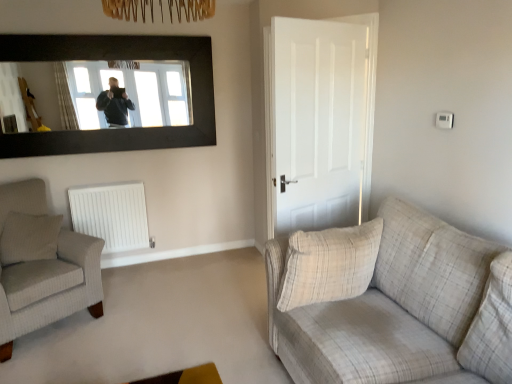
In order to face plaid fabric couch at right, should I rotate leftwards or rightwards?

Turn right by 20.790 degrees to look at plaid fabric couch at right.

Describe the element at coordinates (329, 264) in the screenshot. The width and height of the screenshot is (512, 384). I see `beige plaid pillow at right, positioned as the 2th pillow in left-to-right order` at that location.

What is the approximate width of beige plaid pillow at right, the first pillow viewed from the front?

beige plaid pillow at right, the first pillow viewed from the front, is 10.74 inches wide.

This screenshot has height=384, width=512. I want to click on white matte radiator at lower left, so click(x=112, y=215).

Can you tell me how much light gray fabric armchair at left and white matte door at center differ in facing direction?

light gray fabric armchair at left and white matte door at center are facing 167 degrees away from each other.

In terms of width, does light gray fabric armchair at left look wider or thinner when compared to white matte door at center?

Considering their sizes, light gray fabric armchair at left looks broader than white matte door at center.

Find the location of a particular element. Image resolution: width=512 pixels, height=384 pixels. door that appears behind the light gray fabric armchair at left is located at coordinates (319, 120).

Are light gray fabric armchair at left and white matte door at center located far from each other?

Absolutely, light gray fabric armchair at left is distant from white matte door at center.

Is point (111, 195) behind point (32, 254)?

Yes, point (111, 195) is farther from viewer.

From the image's perspective, is white matte radiator at lower left positioned above or below beige textured pillow at left, which is the 2th pillow in front-to-back order?

white matte radiator at lower left is situated higher than beige textured pillow at left, which is the 2th pillow in front-to-back order, in the image.

From a real-world perspective, between white matte radiator at lower left and beige textured pillow at left, acting as the 2th pillow starting from the right, who is vertically lower?

From a 3D spatial view, white matte radiator at lower left is below.

Is white matte radiator at lower left to the left or to the right of beige textured pillow at left, acting as the 2th pillow starting from the right, in the image?

Based on their positions, white matte radiator at lower left is located to the right of beige textured pillow at left, acting as the 2th pillow starting from the right.

Consider the image. Is the surface of white matte radiator at lower left in direct contact with white matte door at center?

No, white matte radiator at lower left is not touching white matte door at center.

Is point (129, 234) positioned in front of point (304, 87)?

No, it is behind (304, 87).

Image resolution: width=512 pixels, height=384 pixels. In order to click on radiator that appears below the white matte door at center (from the image's perspective) in this screenshot , I will do `click(112, 215)`.

From a real-world perspective, which is physically below, beige plaid pillow at right, arranged as the 1th pillow when viewed from the right, or plaid fabric couch at right?

plaid fabric couch at right, from a real-world perspective.

From the image's perspective, would you say beige plaid pillow at right, arranged as the 1th pillow when viewed from the right, is shown under plaid fabric couch at right?

→ Actually, beige plaid pillow at right, arranged as the 1th pillow when viewed from the right, appears above plaid fabric couch at right in the image.

Do you think beige plaid pillow at right, positioned as the 2th pillow in left-to-right order, is within plaid fabric couch at right, or outside of it?

beige plaid pillow at right, positioned as the 2th pillow in left-to-right order, can be found inside plaid fabric couch at right.

Image resolution: width=512 pixels, height=384 pixels. What are the coordinates of `chair above the white matte radiator at lower left (from a real-world perspective)` in the screenshot? It's located at (42, 265).

Considering the relative positions of light gray fabric armchair at left and white matte radiator at lower left in the image provided, is light gray fabric armchair at left to the left or to the right of white matte radiator at lower left?

Based on their positions, light gray fabric armchair at left is located to the left of white matte radiator at lower left.

Considering the sizes of light gray fabric armchair at left and white matte radiator at lower left in the image, is light gray fabric armchair at left taller or shorter than white matte radiator at lower left?

Clearly, light gray fabric armchair at left is taller compared to white matte radiator at lower left.

Identify the location of chair below the beige textured pillow at left, acting as the 2th pillow starting from the right (from a real-world perspective). The width and height of the screenshot is (512, 384). (42, 265).

Which of these two, light gray fabric armchair at left or beige textured pillow at left, acting as the 2th pillow starting from the right, stands taller?

Standing taller between the two is light gray fabric armchair at left.

Is light gray fabric armchair at left to the right of beige textured pillow at left, which is the first pillow from back to front, from the viewer's perspective?

Yes.

Which is less distant, (x=314, y=240) or (x=36, y=250)?

The point (x=314, y=240) is in front.

Between beige plaid pillow at right, positioned as the 2th pillow in left-to-right order, and beige textured pillow at left, which is the first pillow from back to front, which one has smaller width?

beige plaid pillow at right, positioned as the 2th pillow in left-to-right order, is thinner.

Considering the positions of objects beige plaid pillow at right, the first pillow viewed from the front, and beige textured pillow at left, which is the first pillow from back to front, in the image provided, who is more to the right, beige plaid pillow at right, the first pillow viewed from the front, or beige textured pillow at left, which is the first pillow from back to front,?

Positioned to the right is beige plaid pillow at right, the first pillow viewed from the front.

Between beige plaid pillow at right, the first pillow viewed from the front, and beige textured pillow at left, which is the 2th pillow in front-to-back order, which one has less height?

beige textured pillow at left, which is the 2th pillow in front-to-back order, is shorter.

Identify the location of door above the light gray fabric armchair at left (from the image's perspective). The width and height of the screenshot is (512, 384). (319, 120).

Find the location of a particular element. radiator that is on the right side of beige textured pillow at left, which is the first pillow from back to front is located at coordinates (112, 215).

When comparing their distances from plaid fabric couch at right, does white matte door at center or beige textured pillow at left, acting as the 2th pillow starting from the right, seem closer?

white matte door at center.

Which object lies further to the anchor point white matte door at center, white matte radiator at lower left or plaid fabric couch at right?

white matte radiator at lower left is positioned further to the anchor white matte door at center.

Which object lies nearer to the anchor point plaid fabric couch at right, beige plaid pillow at right, arranged as the 1th pillow when viewed from the right, or light gray fabric armchair at left?

Among the two, beige plaid pillow at right, arranged as the 1th pillow when viewed from the right, is located nearer to plaid fabric couch at right.

Which object lies further to the anchor point white matte radiator at lower left, beige plaid pillow at right, arranged as the 1th pillow when viewed from the right, or light gray fabric armchair at left?

The object further to white matte radiator at lower left is beige plaid pillow at right, arranged as the 1th pillow when viewed from the right.

Based on the photo, when comparing their distances from white matte door at center, does beige textured pillow at left, which is the first pillow from back to front, or white matte radiator at lower left seem closer?

white matte radiator at lower left is positioned closer to the anchor white matte door at center.

Looking at the image, which one is located closer to plaid fabric couch at right, beige plaid pillow at right, positioned as the 2th pillow in left-to-right order, or beige textured pillow at left, acting as the 2th pillow starting from the right?

beige plaid pillow at right, positioned as the 2th pillow in left-to-right order, is positioned closer to the anchor plaid fabric couch at right.

Considering their positions, is plaid fabric couch at right positioned closer to light gray fabric armchair at left than beige plaid pillow at right, the first pillow viewed from the front?

beige plaid pillow at right, the first pillow viewed from the front, lies closer to light gray fabric armchair at left than the other object.

Based on their spatial positions, is light gray fabric armchair at left or plaid fabric couch at right further from beige textured pillow at left, which is the 1th pillow in left-to-right order?

Based on the image, plaid fabric couch at right appears to be further to beige textured pillow at left, which is the 1th pillow in left-to-right order.

Where is `radiator situated between light gray fabric armchair at left and beige plaid pillow at right, the first pillow viewed from the front, from left to right`? radiator situated between light gray fabric armchair at left and beige plaid pillow at right, the first pillow viewed from the front, from left to right is located at coordinates (112, 215).

The height and width of the screenshot is (384, 512). Find the location of `door between plaid fabric couch at right and white matte radiator at lower left along the z-axis`. door between plaid fabric couch at right and white matte radiator at lower left along the z-axis is located at coordinates (319, 120).

This screenshot has width=512, height=384. Identify the location of chair between beige textured pillow at left, which is the 2th pillow in front-to-back order, and beige plaid pillow at right, which ranks as the second pillow in back-to-front order, in the horizontal direction. (42, 265).

The height and width of the screenshot is (384, 512). Find the location of `radiator between beige textured pillow at left, which is the first pillow from back to front, and beige plaid pillow at right, which ranks as the second pillow in back-to-front order, from left to right`. radiator between beige textured pillow at left, which is the first pillow from back to front, and beige plaid pillow at right, which ranks as the second pillow in back-to-front order, from left to right is located at coordinates (112, 215).